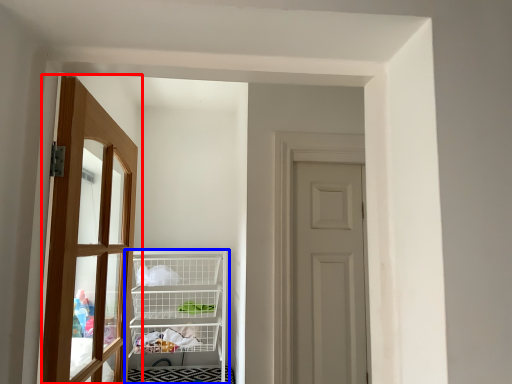
Question: Which of the following is the farthest to the observer, door (highlighted by a red box) or shelf (highlighted by a blue box)?

Choices:
 (A) door
 (B) shelf

Answer: (B)